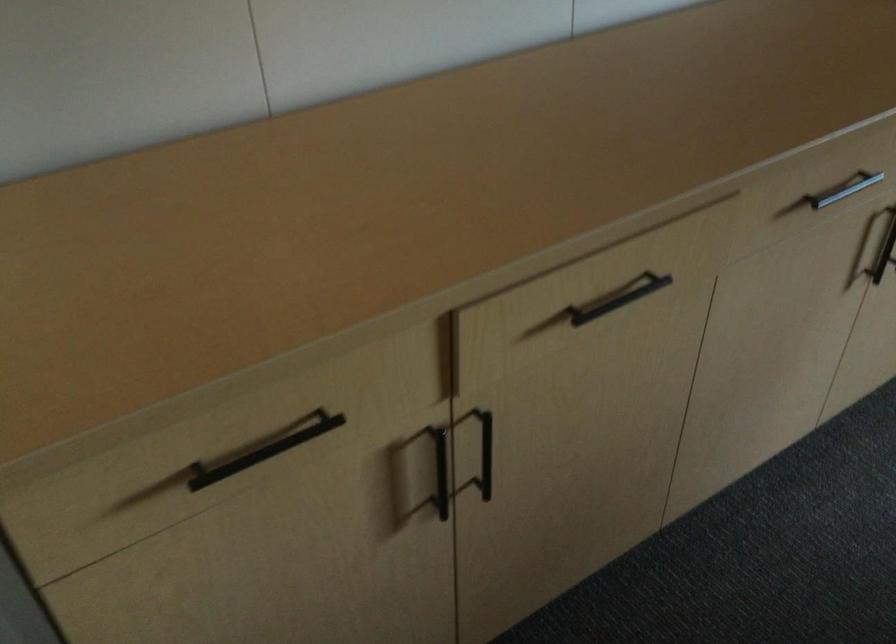
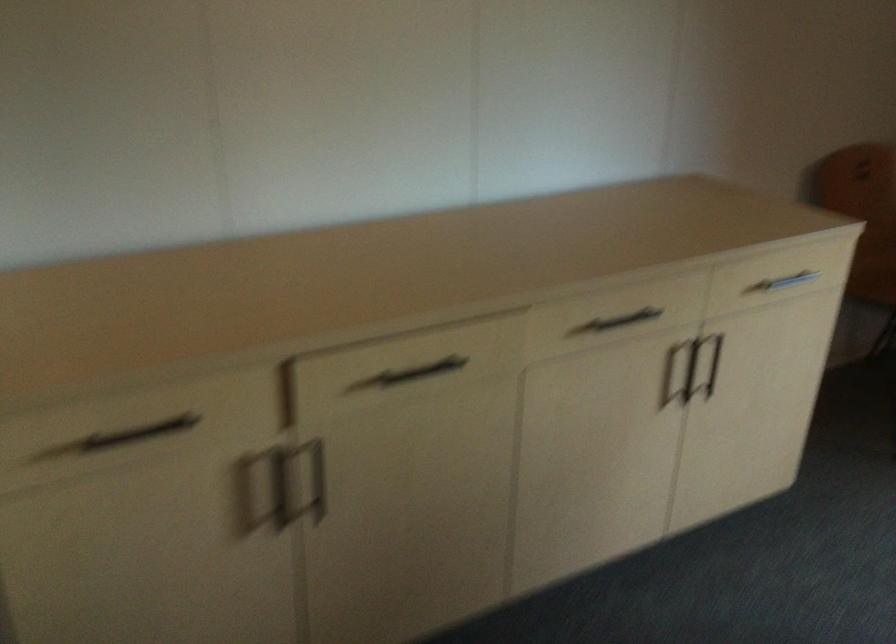
Question: The images are taken continuously from a first-person perspective. In which direction is your viewpoint rotating?

Choices:
 (A) Left
 (B) Right
 (C) Up
 (D) Down

Answer: (C)